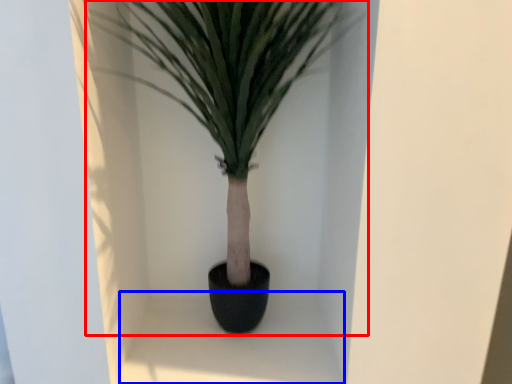
Question: Which object is closer to the camera taking this photo, houseplant (highlighted by a red box) or window sill (highlighted by a blue box)?

Choices:
 (A) houseplant
 (B) window sill

Answer: (A)